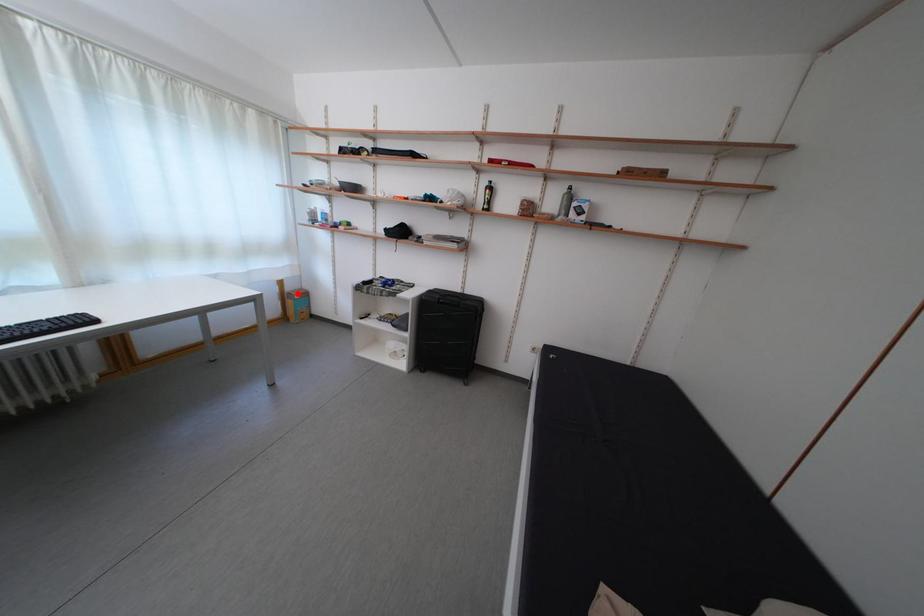
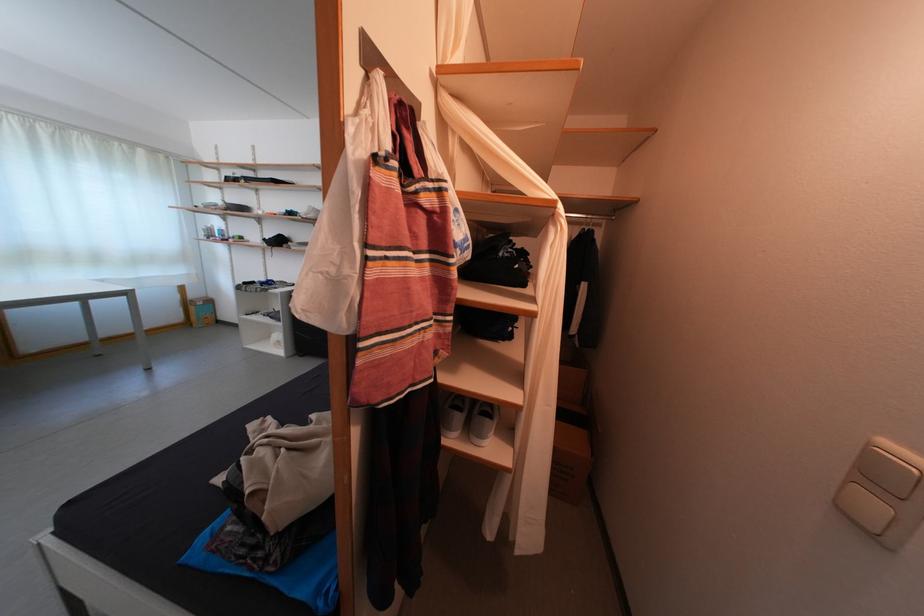
Question: A red point is marked in image1. In image2, is the corresponding 3D point closer to the camera or farther? Reply with the corresponding letter.

Choices:
 (A) The corresponding 3D point is closer.
 (B) The corresponding 3D point is farther.

Answer: (A)